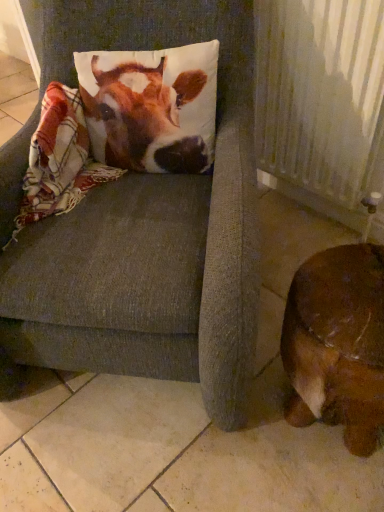
Question: Is printed fabric pillow at upper left not close to brown leather dog at lower right?

Choices:
 (A) no
 (B) yes

Answer: (A)

Question: From the image's perspective, does printed fabric pillow at upper left appear higher than brown leather dog at lower right?

Choices:
 (A) yes
 (B) no

Answer: (A)

Question: Can you confirm if printed fabric pillow at upper left is taller than brown leather dog at lower right?

Choices:
 (A) yes
 (B) no

Answer: (B)

Question: Is printed fabric pillow at upper left positioned behind brown leather dog at lower right?

Choices:
 (A) yes
 (B) no

Answer: (A)

Question: Does printed fabric pillow at upper left have a larger size compared to brown leather dog at lower right?

Choices:
 (A) yes
 (B) no

Answer: (B)

Question: Is textured gray cushion at center to the left or to the right of printed fabric pillow at upper left in the image?

Choices:
 (A) left
 (B) right

Answer: (A)

Question: Looking at their shapes, would you say textured gray cushion at center is wider or thinner than printed fabric pillow at upper left?

Choices:
 (A) wide
 (B) thin

Answer: (A)

Question: Looking at the image, does textured gray cushion at center seem bigger or smaller compared to printed fabric pillow at upper left?

Choices:
 (A) big
 (B) small

Answer: (A)

Question: Which is correct: textured gray cushion at center is inside printed fabric pillow at upper left, or outside of it?

Choices:
 (A) inside
 (B) outside

Answer: (B)

Question: Looking at their shapes, would you say white textured radiator at right is wider or thinner than printed fabric pillow at upper left?

Choices:
 (A) wide
 (B) thin

Answer: (B)

Question: Relative to printed fabric pillow at upper left, is white textured radiator at right in front or behind?

Choices:
 (A) front
 (B) behind

Answer: (B)

Question: Based on their positions, is white textured radiator at right located to the left or right of printed fabric pillow at upper left?

Choices:
 (A) right
 (B) left

Answer: (A)

Question: Considering the positions of white textured radiator at right and printed fabric pillow at upper left in the image, is white textured radiator at right bigger or smaller than printed fabric pillow at upper left?

Choices:
 (A) big
 (B) small

Answer: (A)

Question: Choose the correct answer: Is textured gray cushion at center inside brown leather dog at lower right or outside it?

Choices:
 (A) inside
 (B) outside

Answer: (B)

Question: In the image, is textured gray cushion at center on the left side or the right side of brown leather dog at lower right?

Choices:
 (A) left
 (B) right

Answer: (A)